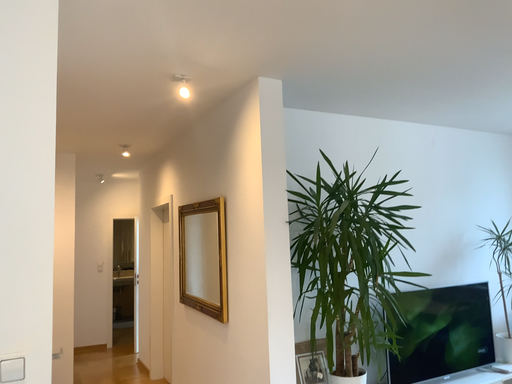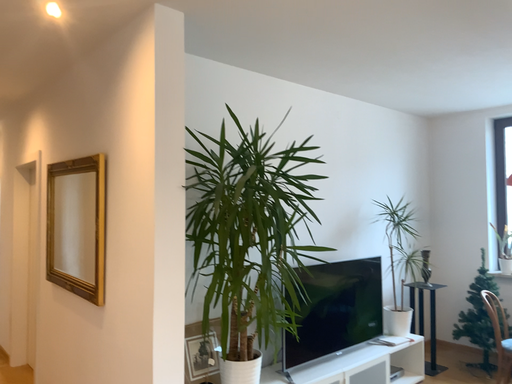
Question: Which way did the camera rotate in the video?

Choices:
 (A) rotated right
 (B) rotated left

Answer: (A)